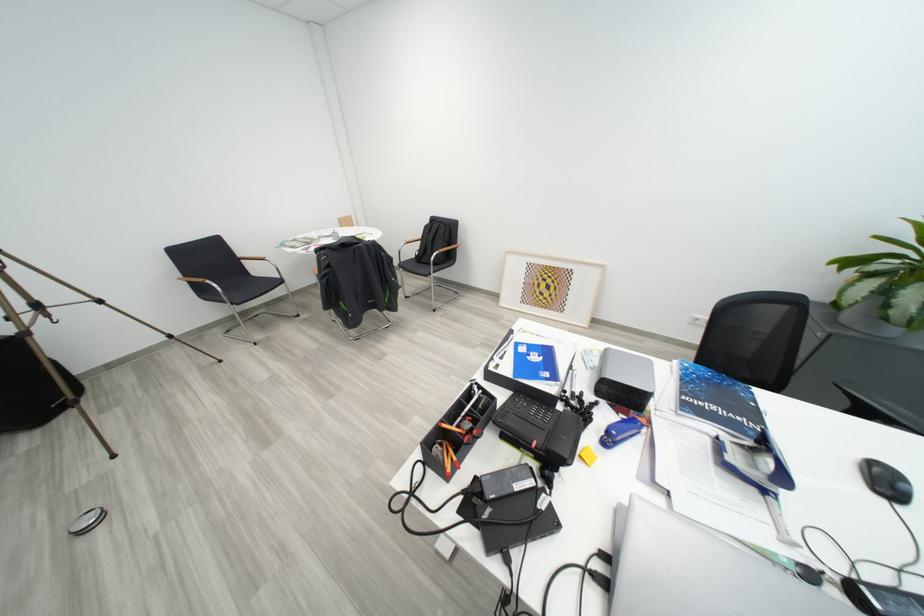
What do you see at coordinates (346, 243) in the screenshot? This screenshot has width=924, height=616. I see `a backpack top handle` at bounding box center [346, 243].